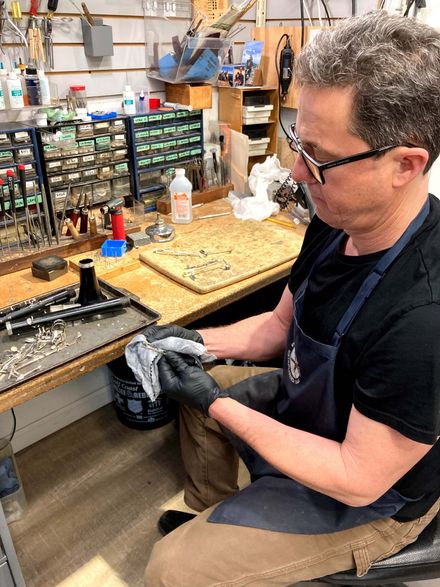
Where is `bottle`? This screenshot has height=587, width=440. bottle is located at coordinates (180, 204).